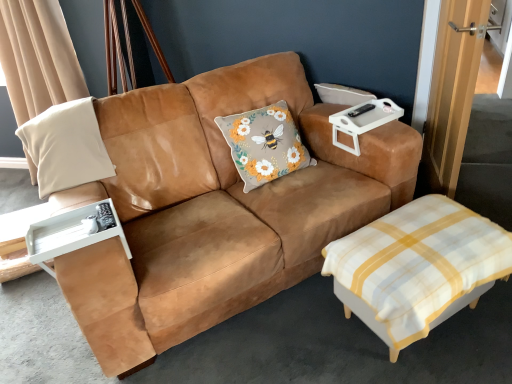
Locate an element on the screen. Image resolution: width=512 pixels, height=384 pixels. white plastic tray at upper right is located at coordinates (362, 121).

What do you see at coordinates (38, 57) in the screenshot? Image resolution: width=512 pixels, height=384 pixels. I see `beige fabric pillow at left` at bounding box center [38, 57].

What do you see at coordinates (452, 90) in the screenshot? I see `wooden door at right` at bounding box center [452, 90].

Find the location of `white plastic tray at upper right`. white plastic tray at upper right is located at coordinates (362, 121).

How much distance is there between wooden door at right and white suede pillow at left?

1.74 meters.

In the scene shown: Which is farther from the camera, (424, 137) or (52, 164)?

Positioned behind is point (424, 137).

Is there a large distance between wooden door at right and white suede pillow at left?

Indeed, wooden door at right is not near white suede pillow at left.

Does wooden door at right contain white suede pillow at left?

No, wooden door at right does not contain white suede pillow at left.

Visually, is suede tan couch at center positioned to the left or to the right of beige fabric pillow at left?

Based on their positions, suede tan couch at center is located to the right of beige fabric pillow at left.

I want to click on studio couch located on the right of beige fabric pillow at left, so click(x=216, y=208).

Consider the image. Is suede tan couch at center looking in the opposite direction of beige fabric pillow at left?

Yes, suede tan couch at center is positioned with its back facing beige fabric pillow at left.

Looking at this image, is suede tan couch at center wider than beige fabric pillow at left?

Yes.

From the image's perspective, which one is positioned higher, suede tan couch at center or white plastic tray at upper right?

white plastic tray at upper right is shown above in the image.

Can you confirm if suede tan couch at center is positioned to the right of white plastic tray at upper right?

No.

Can you confirm if suede tan couch at center is taller than white plastic tray at upper right?

Yes.

Which of these two, fluffy beige cushion with floral design at center or white plastic tray at left, is smaller?

white plastic tray at left.

Is fluffy beige cushion with floral design at center further to the viewer compared to white plastic tray at left?

Yes, it is behind white plastic tray at left.

From a real-world perspective, which object rests below the other?

In real-world perspective, fluffy beige cushion with floral design at center is lower.

From the image's perspective, is fluffy beige cushion with floral design at center located above or below white plastic tray at left?

Based on their image positions, fluffy beige cushion with floral design at center is located above white plastic tray at left.

Where is `studio couch to the right of white plastic tray at left`? studio couch to the right of white plastic tray at left is located at coordinates (216, 208).

Does point (192, 140) come farther from viewer compared to point (47, 226)?

Yes, point (192, 140) is behind point (47, 226).

Between suede tan couch at center and white plastic tray at left, which one has smaller width?

With smaller width is white plastic tray at left.

Are white suede pillow at left and white plastic tray at left beside each other?

white suede pillow at left is not next to white plastic tray at left, and they're not touching.

From the picture: From a real-world perspective, is white suede pillow at left positioned over white plastic tray at left based on gravity?

Yes, from a real-world perspective, white suede pillow at left is above white plastic tray at left.

How far apart are white suede pillow at left and white plastic tray at left?

white suede pillow at left is 15.69 inches away from white plastic tray at left.

Is point (372, 118) behind point (77, 151)?

Yes, it is.

From the image's perspective, would you say white plastic tray at upper right is shown under white suede pillow at left?

No.

Consider the image. Do you think white plastic tray at upper right is within white suede pillow at left, or outside of it?

white plastic tray at upper right is spatially situated outside white suede pillow at left.

Which of these two, white plastic tray at upper right or white suede pillow at left, is smaller?

white plastic tray at upper right.

There is a wooden door at right. Identify the location of pillow above it (from a real-world perspective). Image resolution: width=512 pixels, height=384 pixels. (66, 146).

Find the location of a particular element. curtain that appears behind the suede tan couch at center is located at coordinates (38, 57).

When comparing their distances from white suede pillow at left, does white checkered ottoman at lower right or white plastic tray at upper right seem closer?

white plastic tray at upper right lies closer to white suede pillow at left than the other object.

From the image, which object appears to be farther from beige fabric pillow at left, fluffy beige cushion with floral design at center or wooden door at right?

The object further to beige fabric pillow at left is wooden door at right.

Considering their positions, is wooden door at right positioned closer to beige fabric pillow at left than white plastic tray at upper right?

Based on the image, white plastic tray at upper right appears to be nearer to beige fabric pillow at left.

Estimate the real-world distances between objects in this image. Which object is further from wooden door at right, white plastic tray at left or beige fabric pillow at left?

beige fabric pillow at left.

When comparing their distances from wooden door at right, does white checkered ottoman at lower right or white suede pillow at left seem closer?

white checkered ottoman at lower right lies closer to wooden door at right than the other object.

Consider the image. Estimate the real-world distances between objects in this image. Which object is closer to white plastic tray at left, fluffy beige cushion with floral design at center or beige fabric pillow at left?

fluffy beige cushion with floral design at center is closer to white plastic tray at left.

Estimate the real-world distances between objects in this image. Which object is closer to beige fabric pillow at left, white plastic tray at left or white suede pillow at left?

The object closer to beige fabric pillow at left is white suede pillow at left.

Looking at the image, which one is located closer to white plastic tray at upper right, fluffy beige cushion with floral design at center or suede tan couch at center?

fluffy beige cushion with floral design at center is positioned closer to the anchor white plastic tray at upper right.

Image resolution: width=512 pixels, height=384 pixels. What are the coordinates of `studio couch situated between white suede pillow at left and white plastic tray at upper right from left to right` in the screenshot? It's located at (216, 208).

Where is `cocktail table between white plastic tray at left and wooden door at right from left to right`? The image size is (512, 384). cocktail table between white plastic tray at left and wooden door at right from left to right is located at coordinates (362, 121).

Where is `throw pillow between white checkered ottoman at lower right and white plastic tray at upper right in the front-back direction`? throw pillow between white checkered ottoman at lower right and white plastic tray at upper right in the front-back direction is located at coordinates point(264,144).

Locate an element on the screen. side table situated between white suede pillow at left and suede tan couch at center from left to right is located at coordinates (x=73, y=232).